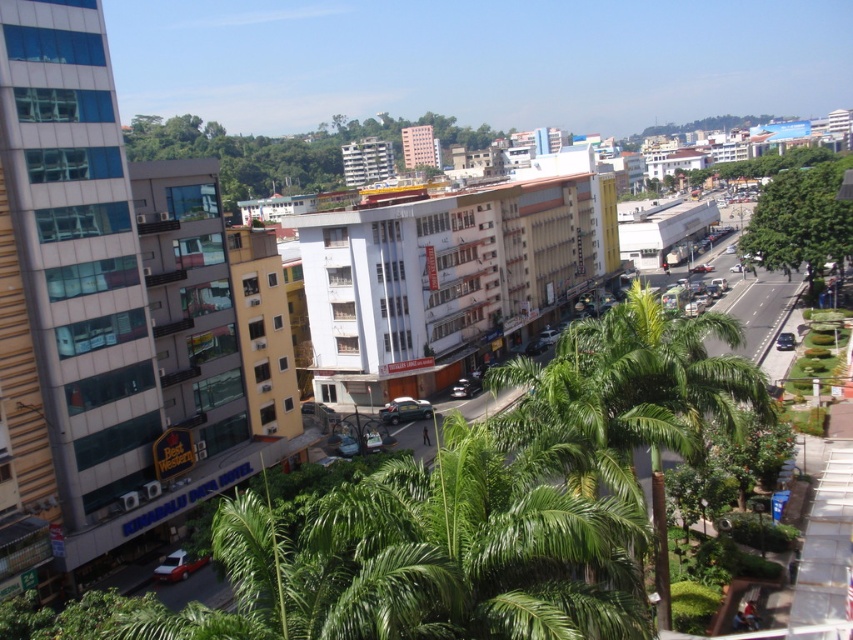
Is metallic red car at lower left in front of metallic green car at center?

Yes, metallic red car at lower left is closer to the viewer.

Is point (177, 570) behind point (402, 397)?

No, it is in front of (402, 397).

What are the coordinates of `metallic red car at lower left` in the screenshot? It's located at (178, 564).

Does green leafy tree at center-right have a greater height compared to metallic red car at lower left?

Correct, green leafy tree at center-right is much taller as metallic red car at lower left.

Does green leafy tree at center-right appear over metallic red car at lower left?

Indeed, green leafy tree at center-right is positioned over metallic red car at lower left.

What do you see at coordinates (801, 220) in the screenshot?
I see `green leafy tree at center-right` at bounding box center [801, 220].

At what (x,y) coordinates should I click in order to perform the action: click on green leafy tree at center-right. Please return your answer as a coordinate pair (x, y). Image resolution: width=853 pixels, height=640 pixels. Looking at the image, I should click on (801, 220).

Is green leafy tree at center closer to camera compared to green leafy tree at center-right?

That is False.

I want to click on green leafy tree at center, so click(258, 152).

Identify the location of green leafy tree at center. The width and height of the screenshot is (853, 640). (258, 152).